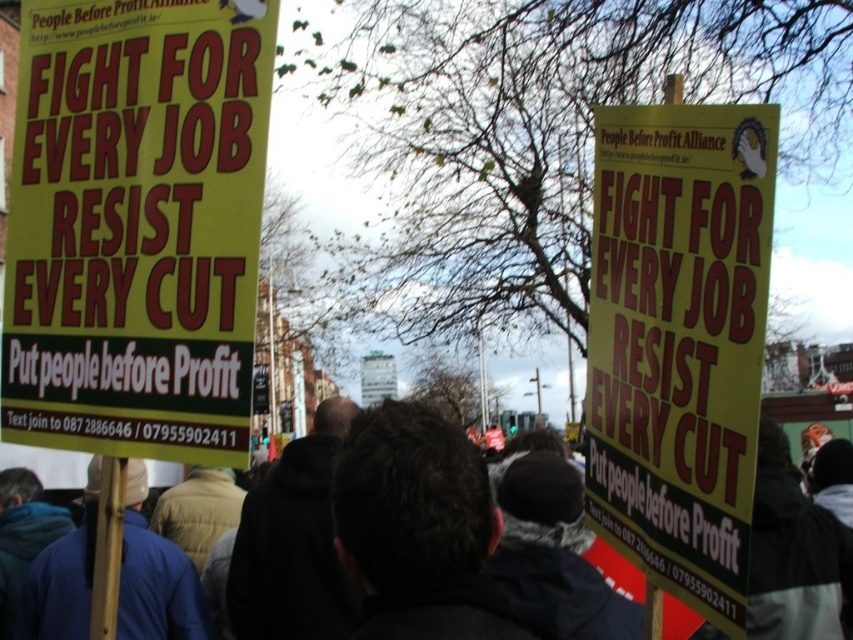
You are a photographer at the protest scene. You want to capture a photo of the yellow paper sign at left. Where should you position yourself to get the best shot?

The yellow paper sign at left is located at point [136,225], so you should position yourself facing that coordinate to capture it effectively.

You are a photographer at the protest scene. You need to capture a photo that includes both the yellow paper sign at left and the yellow paper sign at center. Which sign should you adjust your camera angle to include more of its text details since it is wider?

The yellow paper sign at left is wider than the yellow paper sign at center, so you should adjust your camera angle to include more of the text details on the yellow paper sign at left.